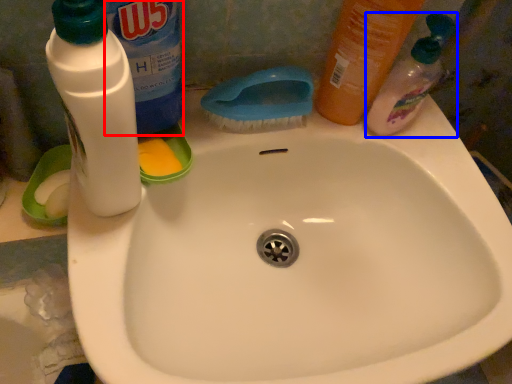
Question: Which object appears closest to the camera in this image, cleaning product (highlighted by a red box) or cleaning product (highlighted by a blue box)?

Choices:
 (A) cleaning product
 (B) cleaning product

Answer: (A)